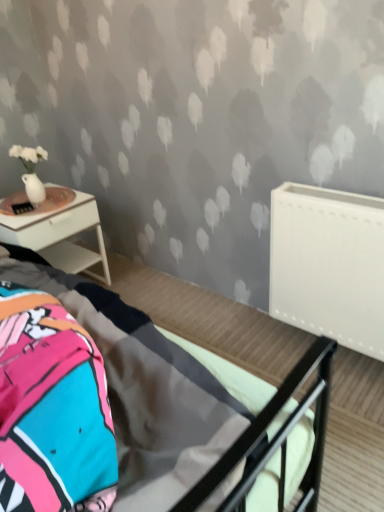
Question: From a real-world perspective, is metallic gray bed at center located beneath white matte radiator at right?

Choices:
 (A) yes
 (B) no

Answer: (B)

Question: Considering the relative sizes of metallic gray bed at center and white matte radiator at right in the image provided, is metallic gray bed at center wider than white matte radiator at right?

Choices:
 (A) yes
 (B) no

Answer: (A)

Question: From the image's perspective, does metallic gray bed at center appear higher than white matte radiator at right?

Choices:
 (A) yes
 (B) no

Answer: (B)

Question: Considering the relative sizes of metallic gray bed at center and white matte radiator at right in the image provided, is metallic gray bed at center smaller than white matte radiator at right?

Choices:
 (A) yes
 (B) no

Answer: (B)

Question: From the image's perspective, would you say metallic gray bed at center is shown under white matte radiator at right?

Choices:
 (A) no
 (B) yes

Answer: (B)

Question: Is metallic gray bed at center shorter than white matte radiator at right?

Choices:
 (A) yes
 (B) no

Answer: (B)

Question: Is white matte radiator at right thinner than metallic gray bed at center?

Choices:
 (A) no
 (B) yes

Answer: (B)

Question: Is metallic gray bed at center located within white matte radiator at right?

Choices:
 (A) yes
 (B) no

Answer: (B)

Question: Does white matte radiator at right have a greater height compared to metallic gray bed at center?

Choices:
 (A) no
 (B) yes

Answer: (A)

Question: Does white matte radiator at right appear on the left side of metallic gray bed at center?

Choices:
 (A) yes
 (B) no

Answer: (B)

Question: From the image's perspective, is white matte radiator at right over metallic gray bed at center?

Choices:
 (A) no
 (B) yes

Answer: (B)

Question: From the image's perspective, is white matte radiator at right beneath metallic gray bed at center?

Choices:
 (A) no
 (B) yes

Answer: (A)

Question: From the image's perspective, is white glossy nightstand at left located above metallic gray bed at center?

Choices:
 (A) no
 (B) yes

Answer: (B)